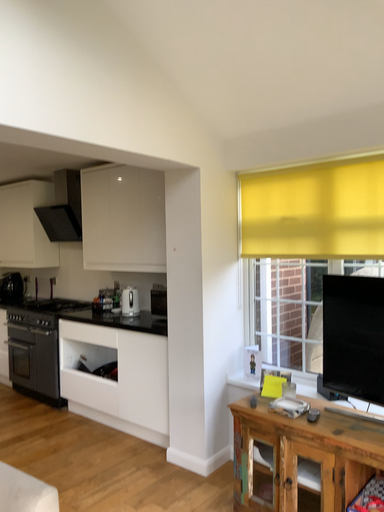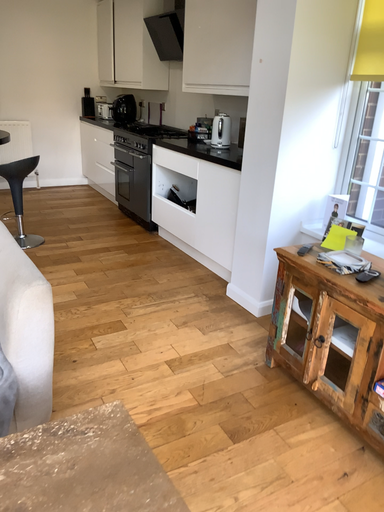
Question: Which way did the camera rotate in the video?

Choices:
 (A) rotated right
 (B) rotated left

Answer: (B)